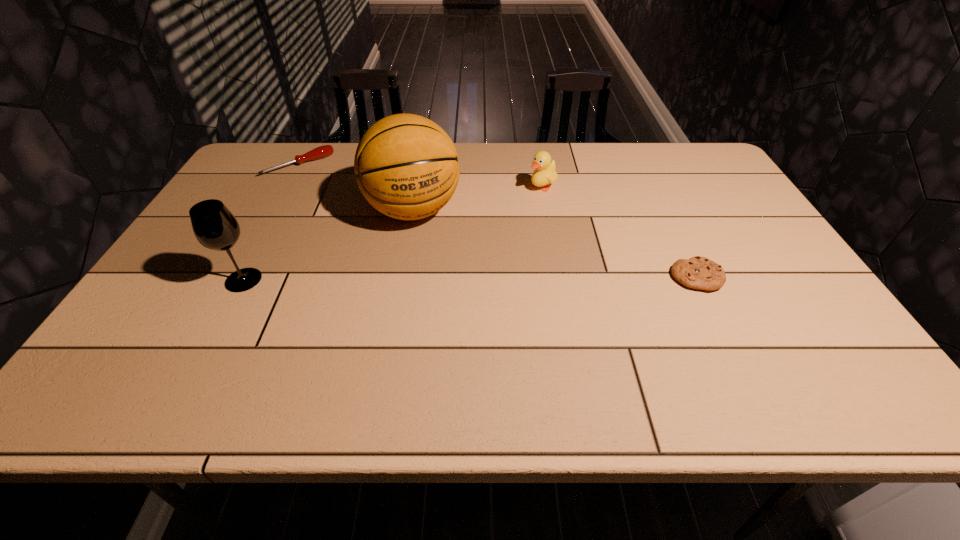
The height and width of the screenshot is (540, 960). Identify the location of the fourth shortest object. (214, 226).

Locate an element on the screen. cookie is located at coordinates (698, 272).

What are the coordinates of `the shortest object` in the screenshot? It's located at (698, 272).

Find the location of a particular element. This screenshot has width=960, height=540. basketball is located at coordinates (406, 166).

Image resolution: width=960 pixels, height=540 pixels. Identify the location of the third object from left to right. (406, 166).

Find the location of a particular element. screwdriver is located at coordinates (320, 152).

This screenshot has height=540, width=960. Identify the location of the fourth object from left to right. (545, 170).

At what (x,y) coordinates should I click in order to perform the action: click on duckling. Please return your answer as a coordinate pair (x, y). Looking at the image, I should click on (545, 170).

I want to click on vacant region located on the right of the fourth shortest object, so click(x=319, y=280).

The image size is (960, 540). Find the location of `free spot located on the front of the shortest object`. free spot located on the front of the shortest object is located at coordinates (733, 353).